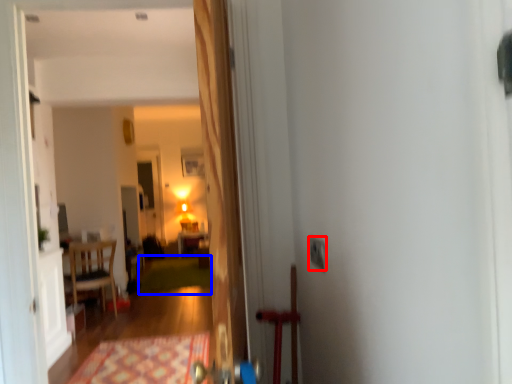
Question: Among these objects, which one is farthest to the camera, electric outlet (highlighted by a red box) or doormat (highlighted by a blue box)?

Choices:
 (A) electric outlet
 (B) doormat

Answer: (B)